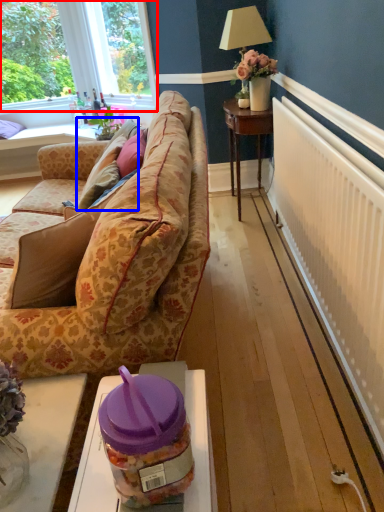
Question: Among these objects, which one is nearest to the camera, window (highlighted by a red box) or pillow (highlighted by a blue box)?

Choices:
 (A) window
 (B) pillow

Answer: (B)